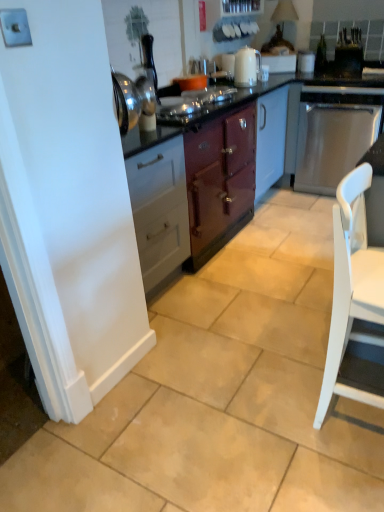
Question: Considering the relative sizes of white glossy electric kettle at upper center, which ranks as the 2th kitchen appliance in right-to-left order, and white matte chair at lower right in the image provided, is white glossy electric kettle at upper center, which ranks as the 2th kitchen appliance in right-to-left order, thinner than white matte chair at lower right?

Choices:
 (A) yes
 (B) no

Answer: (A)

Question: Is the depth of white glossy electric kettle at upper center, which ranks as the 2th kitchen appliance in right-to-left order, greater than that of white matte chair at lower right?

Choices:
 (A) yes
 (B) no

Answer: (A)

Question: Can you confirm if white glossy electric kettle at upper center, which ranks as the 2th kitchen appliance in right-to-left order, is bigger than white matte chair at lower right?

Choices:
 (A) no
 (B) yes

Answer: (A)

Question: Could you tell me if white glossy electric kettle at upper center, the first kitchen appliance when ordered from left to right, is facing white matte chair at lower right?

Choices:
 (A) yes
 (B) no

Answer: (B)

Question: Does white glossy electric kettle at upper center, which ranks as the 2th kitchen appliance in right-to-left order, have a smaller size compared to white matte chair at lower right?

Choices:
 (A) no
 (B) yes

Answer: (B)

Question: Considering the relative sizes of white glossy electric kettle at upper center, which ranks as the 2th kitchen appliance in right-to-left order, and white matte chair at lower right in the image provided, is white glossy electric kettle at upper center, which ranks as the 2th kitchen appliance in right-to-left order, wider than white matte chair at lower right?

Choices:
 (A) yes
 (B) no

Answer: (B)

Question: Does stainless steel dishwasher at right, the 2th kitchen appliance viewed from the left, lie in front of satin black toaster at upper right, which is the 1th appliance in right-to-left order?

Choices:
 (A) no
 (B) yes

Answer: (B)

Question: Is stainless steel dishwasher at right, the 2th kitchen appliance viewed from the left, smaller than satin black toaster at upper right, which is the 1th appliance in right-to-left order?

Choices:
 (A) no
 (B) yes

Answer: (A)

Question: Considering the relative sizes of stainless steel dishwasher at right, the first kitchen appliance from the right, and satin black toaster at upper right, which appears as the second appliance when viewed from the left, in the image provided, is stainless steel dishwasher at right, the first kitchen appliance from the right, wider than satin black toaster at upper right, which appears as the second appliance when viewed from the left,?

Choices:
 (A) no
 (B) yes

Answer: (B)

Question: Does stainless steel dishwasher at right, the first kitchen appliance from the right, have a larger size compared to satin black toaster at upper right, which appears as the second appliance when viewed from the left?

Choices:
 (A) no
 (B) yes

Answer: (B)

Question: Is stainless steel dishwasher at right, the first kitchen appliance from the right, shorter than satin black toaster at upper right, which appears as the second appliance when viewed from the left?

Choices:
 (A) no
 (B) yes

Answer: (A)

Question: From a real-world perspective, does stainless steel dishwasher at right, the first kitchen appliance from the right, sit lower than satin black toaster at upper right, which appears as the second appliance when viewed from the left?

Choices:
 (A) no
 (B) yes

Answer: (B)

Question: Does satin black toaster at upper right, which is the 1th appliance in right-to-left order, have a smaller size compared to stainless steel dishwasher at right, the 2th kitchen appliance viewed from the left?

Choices:
 (A) no
 (B) yes

Answer: (B)